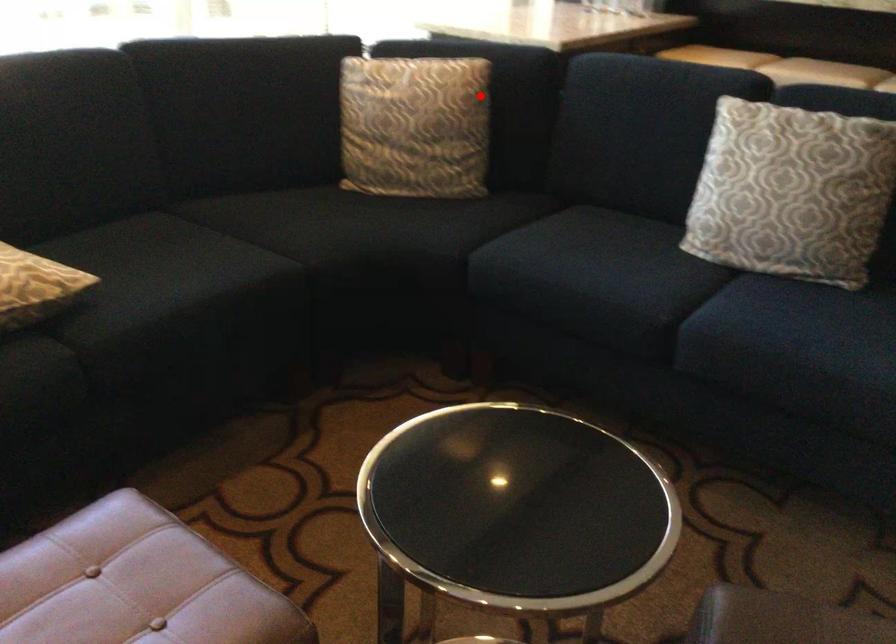
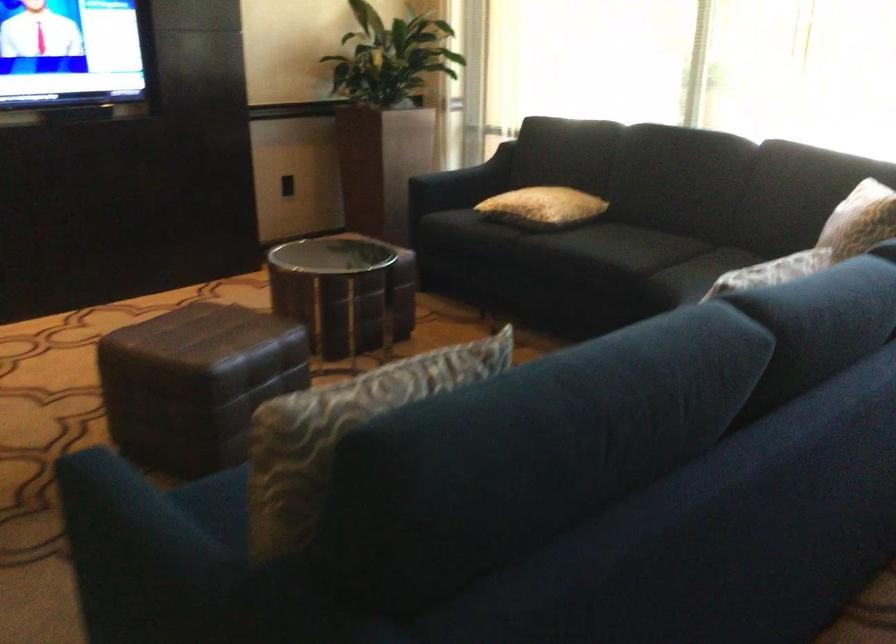
Find the pixel in the second image that matches the highlighted location in the first image.

(859, 220)